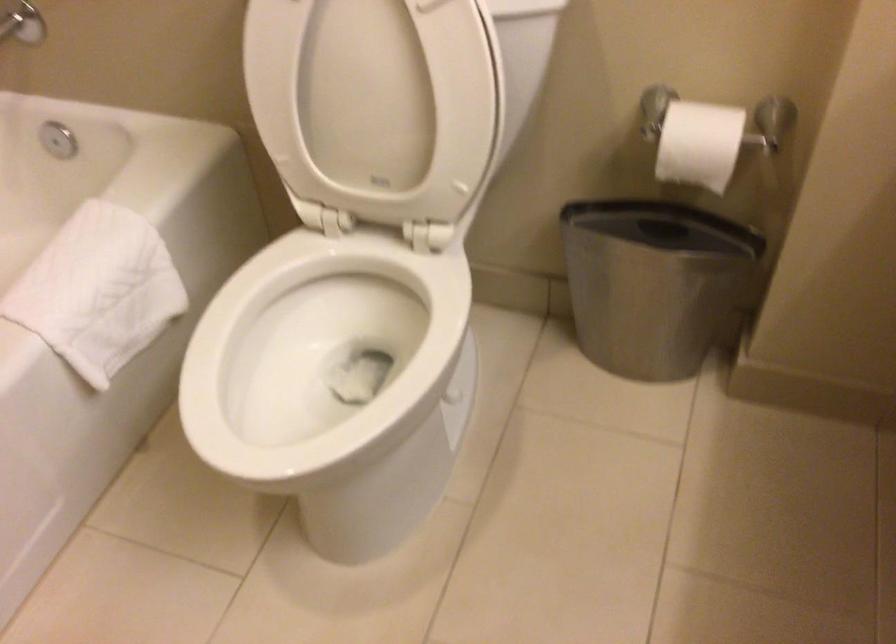
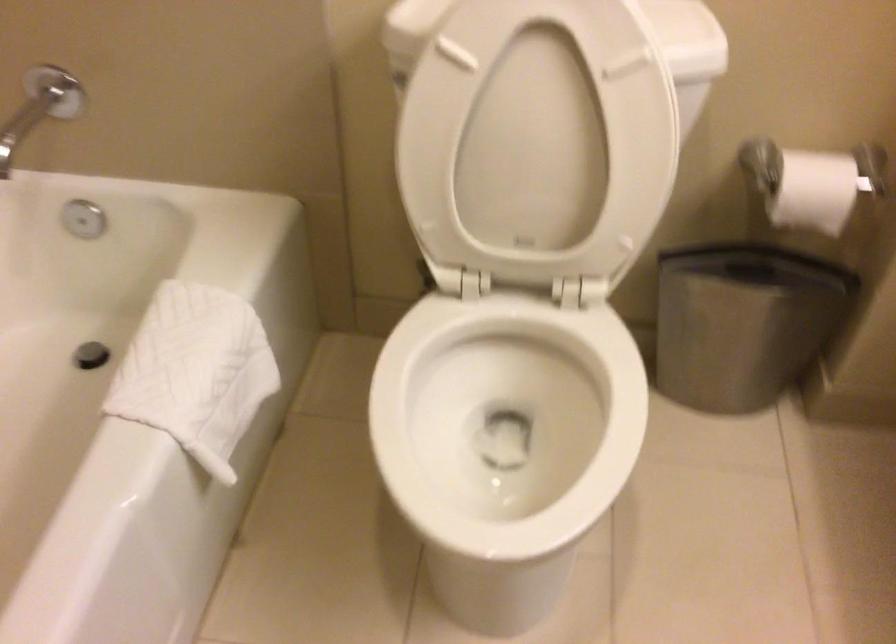
Find the pixel in the second image that matches [382,359] in the first image.

(505, 420)